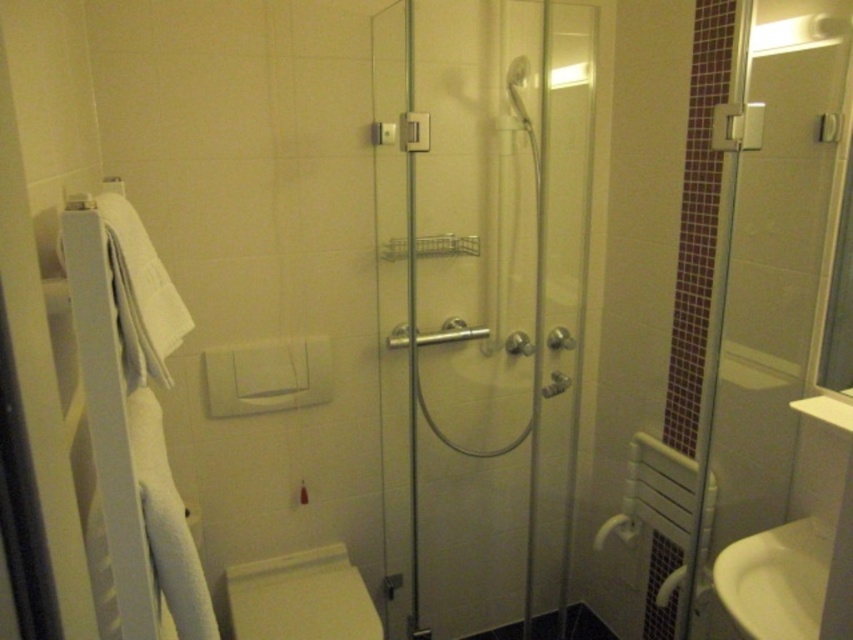
Question: Can you confirm if transparent glass shower door at right is positioned below white plastic towel rack at left?

Choices:
 (A) no
 (B) yes

Answer: (B)

Question: Which of these objects is positioned closest to the transparent glass shower door at right?

Choices:
 (A) white glossy toilet bowl at lower center
 (B) white plastic towel rack at left
 (C) white glossy sink at lower right

Answer: (C)

Question: Among these points, which one is farthest from the camera?

Choices:
 (A) (289, 604)
 (B) (62, 600)

Answer: (A)

Question: Can you confirm if white plastic towel rack at left is positioned to the left of white glossy sink at lower right?

Choices:
 (A) no
 (B) yes

Answer: (B)

Question: Does transparent glass shower door at center appear on the left side of transparent glass shower door at right?

Choices:
 (A) yes
 (B) no

Answer: (A)

Question: Which point appears closest to the camera in this image?

Choices:
 (A) (323, 624)
 (B) (527, 282)
 (C) (842, 67)
 (D) (59, 500)

Answer: (D)